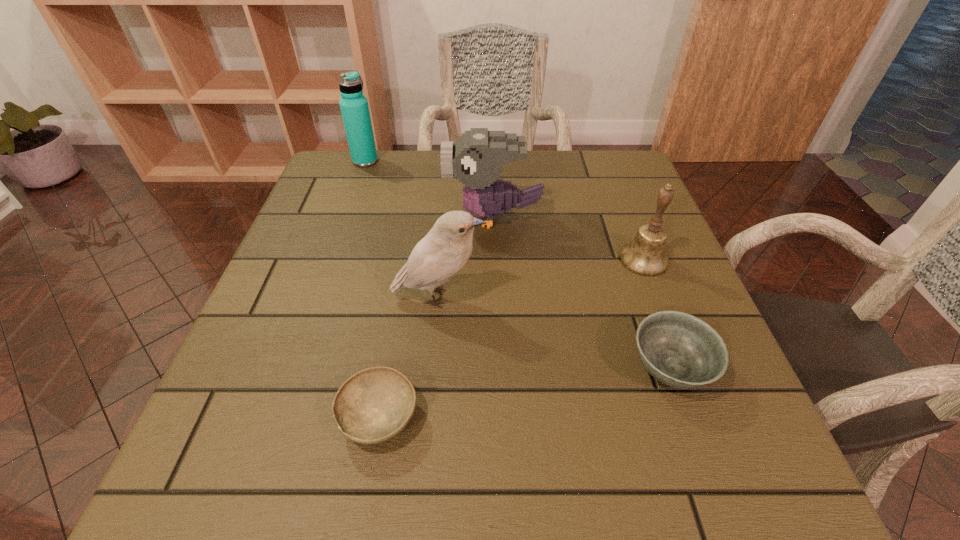
Where is `bell located in the right edge section of the desktop`? This screenshot has width=960, height=540. bell located in the right edge section of the desktop is located at coordinates (645, 255).

Find the location of a particular element. This screenshot has height=540, width=960. bowl that is at the right edge is located at coordinates [x=678, y=349].

You are a GUI agent. You are given a task and a screenshot of the screen. Output one action in this format:
    pyautogui.click(x=<x>, y=<y>)
    Task: Click on the object that is at the far left corner
    The width and height of the screenshot is (960, 540).
    Given the screenshot: What is the action you would take?
    pyautogui.click(x=354, y=107)

In the image, there is a desktop. At what (x,y) coordinates should I click in order to perform the action: click on free space at the far edge. Please return your answer as a coordinate pair (x, y). This screenshot has height=540, width=960. Looking at the image, I should click on (571, 197).

The width and height of the screenshot is (960, 540). Identify the location of vacant space at the left edge. (237, 372).

You are a GUI agent. You are given a task and a screenshot of the screen. Output one action in this format:
    pyautogui.click(x=<x>, y=<y>)
    Task: Click on the vacant area at the right edge
    
    Given the screenshot: What is the action you would take?
    pyautogui.click(x=610, y=261)

In the image, there is a desktop. Identify the location of free space at the far left corner. The height and width of the screenshot is (540, 960). (317, 193).

Find the location of a particular element. This screenshot has height=540, width=960. vacant space at the near left corner of the desktop is located at coordinates (268, 471).

Identify the location of free location at the far right corner of the desktop. (610, 166).

Find the location of a particular element. This screenshot has height=540, width=960. free space between the water bottle and the second farthest object is located at coordinates (429, 189).